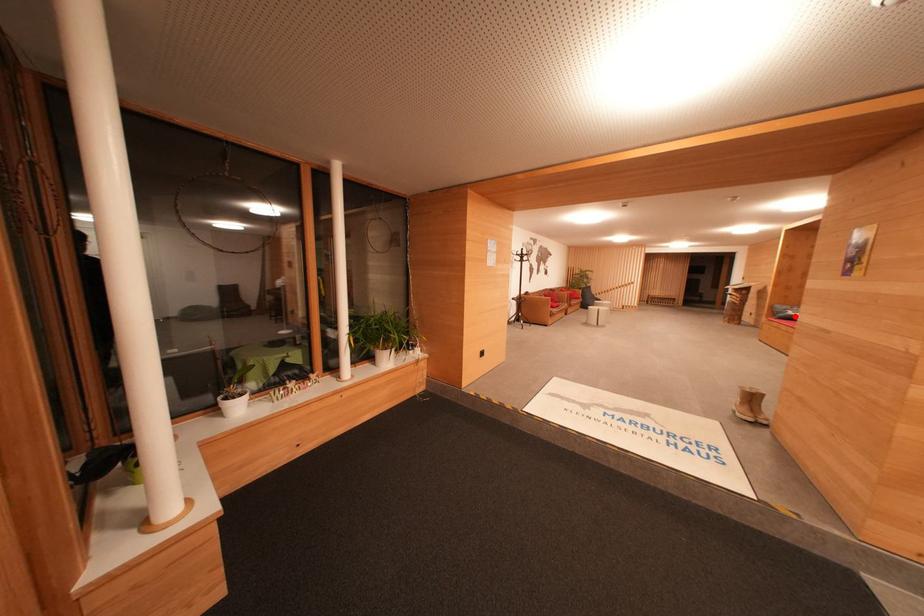
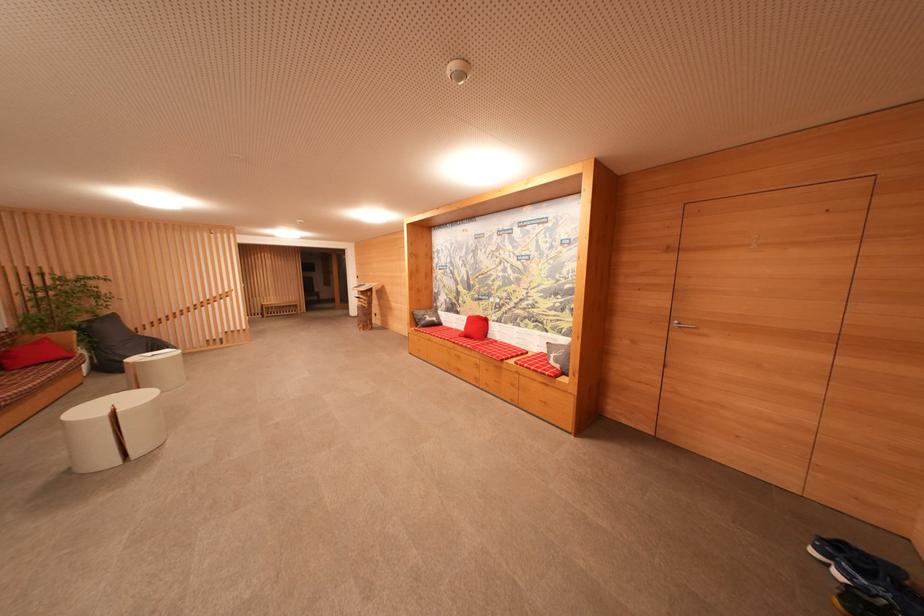
The point at the highlighted location is marked in the first image. Where is the corresponding point in the second image?

(432, 322)